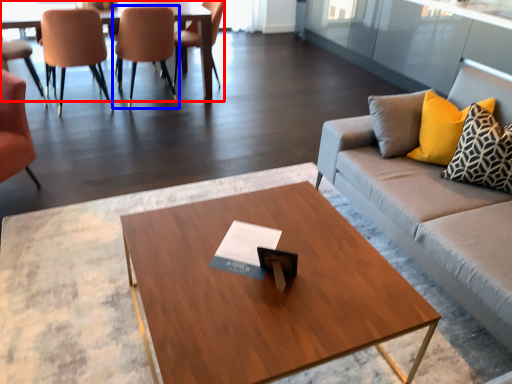
Question: Which object appears closest to the camera in this image, table (highlighted by a red box) or chair (highlighted by a blue box)?

Choices:
 (A) table
 (B) chair

Answer: (A)